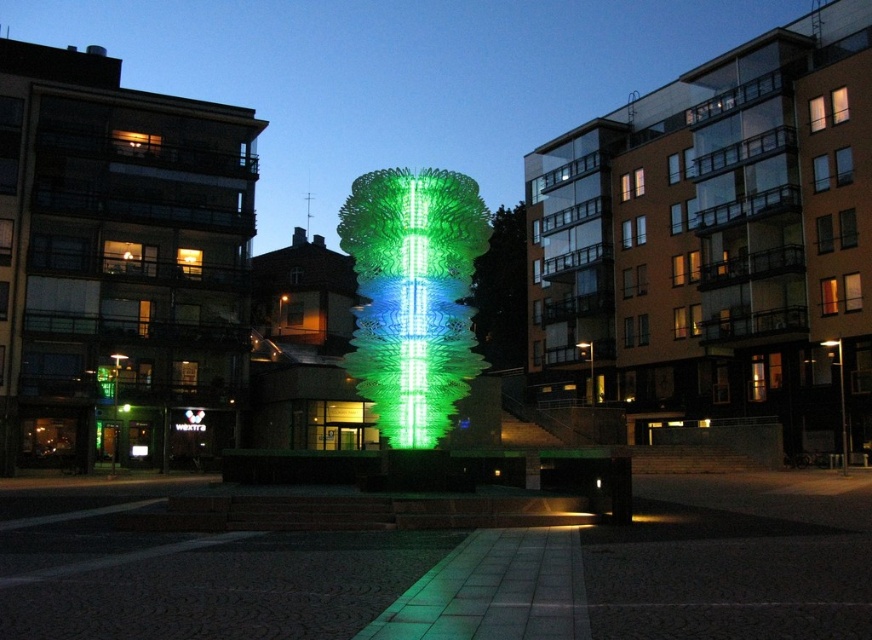
You are standing in the urban scene and want to take a photo of both the green translucent sculpture at center and the green textured tree at center. Since the sculpture is closer to you, will it appear larger in the photo compared to the tree?

Yes, the green translucent sculpture at center will appear larger in the photo than the green textured tree at center because it is closer to the viewer.

You are standing at the camera position and want to take a photo of the green translucent sculpture at center. If your camera has a maximum focus range of 35 meters, will you be able to capture the sculpture in focus?

The green translucent sculpture at center is 37.86 meters from the camera, which exceeds the camera maximum focus range of 35 meters. Therefore, you won not be able to capture the sculpture in focus.

You are an urban planner reviewing the layout of the city park. You notice the green translucent sculpture at center and the green textured tree at center. Based on their positions, which one is located to the right side of the other?

The green translucent sculpture at center is positioned on the left side of green textured tree at center, so the green textured tree at center is to the right of the green translucent sculpture at center.